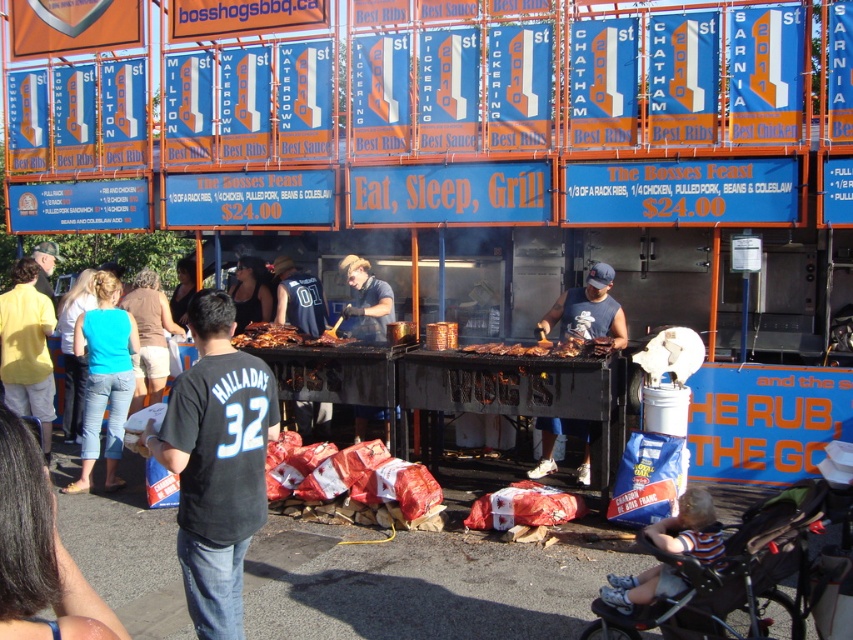
Question: Which point is farther to the camera?

Choices:
 (A) charred wood planks at center
 (B) dark blue sleeveless shirt at center

Answer: (B)

Question: Which object is positioned closest to the dark blue sleeveless shirt at center?

Choices:
 (A) charred wood planks at center
 (B) dark blue jersey at center
 (C) dark blue shirt at center

Answer: (A)

Question: Considering the relative positions of black jersey at center and dark blue sleeveless shirt at center in the image provided, where is black jersey at center located with respect to dark blue sleeveless shirt at center?

Choices:
 (A) below
 (B) above

Answer: (A)

Question: Does black jersey at center appear on the right side of dark blue shirt at center?

Choices:
 (A) yes
 (B) no

Answer: (B)

Question: Which object is positioned farthest from the golden crispy ribs at center?

Choices:
 (A) dark blue jersey at center
 (B) dark blue sleeveless shirt at center
 (C) charred wood planks at center

Answer: (A)

Question: Can you confirm if black jersey at center is positioned to the left of dark blue sleeveless shirt at center?

Choices:
 (A) no
 (B) yes

Answer: (B)